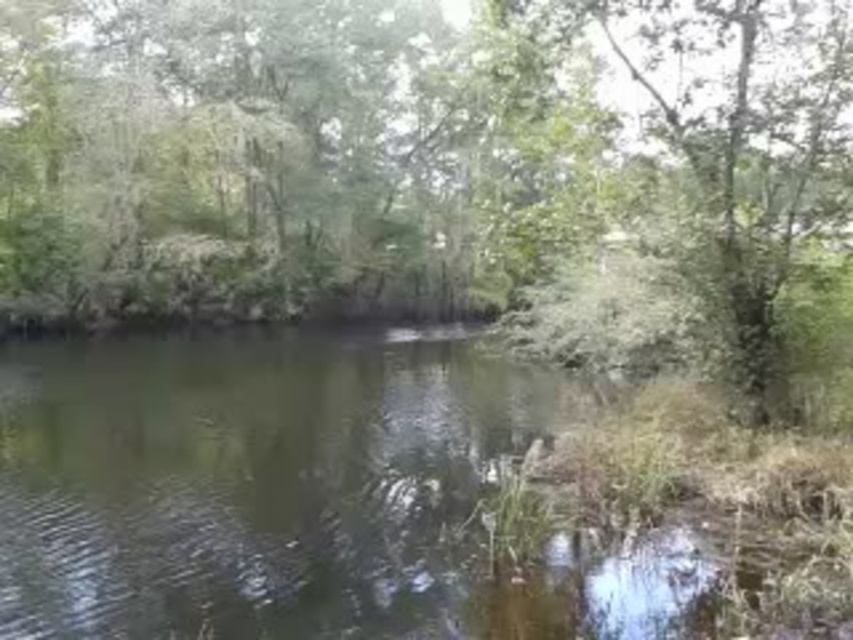
You are standing at the edge of the green grassy river at center and want to reach the green leafy tree at center. Which direction should you move to get closer to the tree?

The green leafy tree at center is above the green grassy river at center, so you should move upward to reach it.

You are standing at point (439,173) in the serene natural scene. What object is located exactly at your current position?

The green leafy tree at center is located exactly at point (439,173).

You are standing at the edge of the green grassy river at center and want to reach the green leafy tree at center. Which direction should you walk to get there?

You should walk to the right to reach the green leafy tree at center because it is located to the left of the green grassy river at center, so from the river, the tree is on your left side, meaning you need to move right to face it and walk towards it.